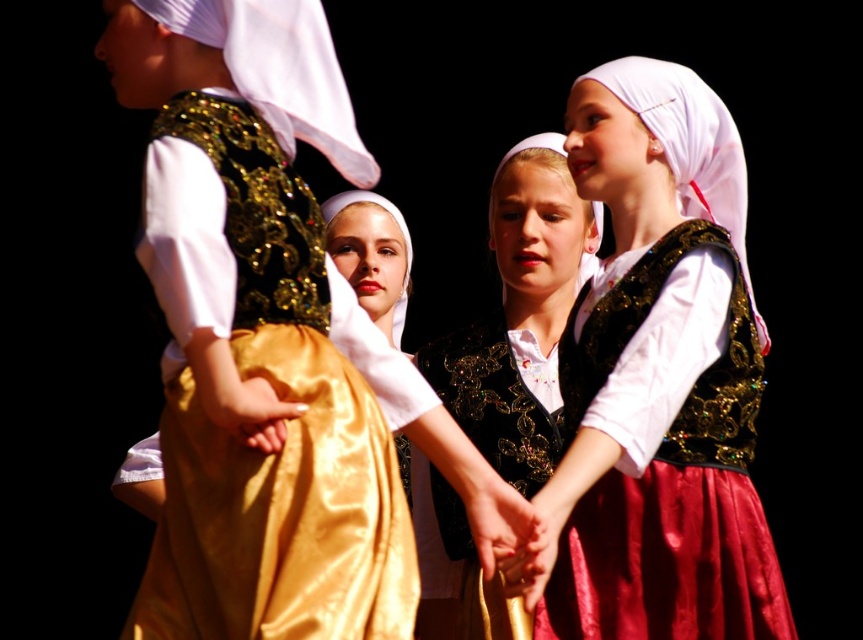
Does smooth golden fabric hand at center lie in front of smooth golden fabric at center?

Yes.

You are a GUI agent. You are given a task and a screenshot of the screen. Output one action in this format:
    pyautogui.click(x=<x>, y=<y>)
    Task: Click on the smooth golden fabric hand at center
    This screenshot has width=863, height=640.
    Given the screenshot: What is the action you would take?
    pyautogui.click(x=496, y=516)

Does satin gold dress at center have a lesser height compared to smooth golden fabric hand at center?

Incorrect, satin gold dress at center's height does not fall short of smooth golden fabric hand at center's.

Between point (183, 452) and point (487, 525), which one is positioned in front?

Point (183, 452)

Locate an element on the screen. satin gold dress at center is located at coordinates (285, 440).

Is satin gold dress at center further to the viewer compared to smooth golden fabric at center?

That is False.

Does satin gold dress at center have a greater width compared to smooth golden fabric at center?

Yes, satin gold dress at center is wider than smooth golden fabric at center.

Locate an element on the screen. Image resolution: width=863 pixels, height=640 pixels. satin gold dress at center is located at coordinates (285, 440).

This screenshot has height=640, width=863. I want to click on satin gold dress at center, so click(285, 440).